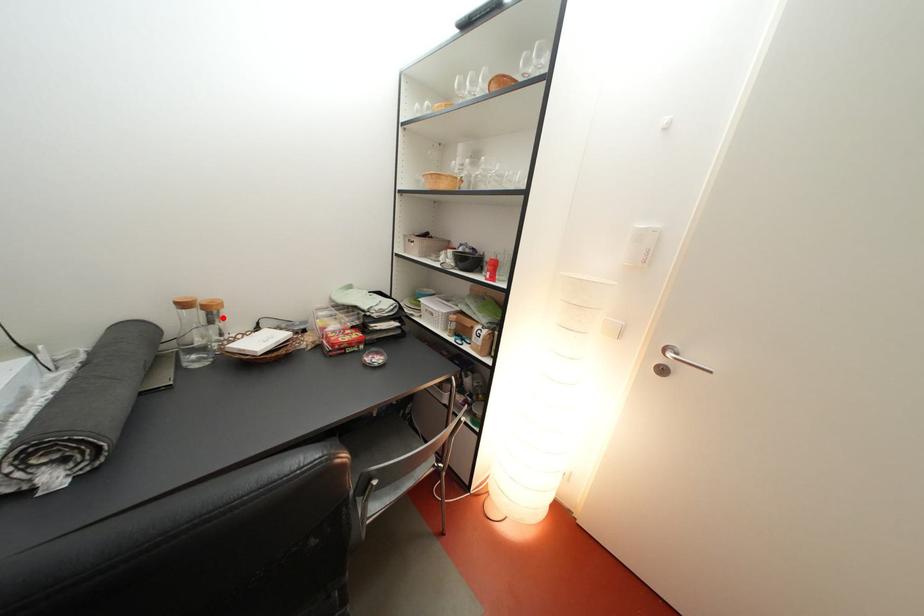
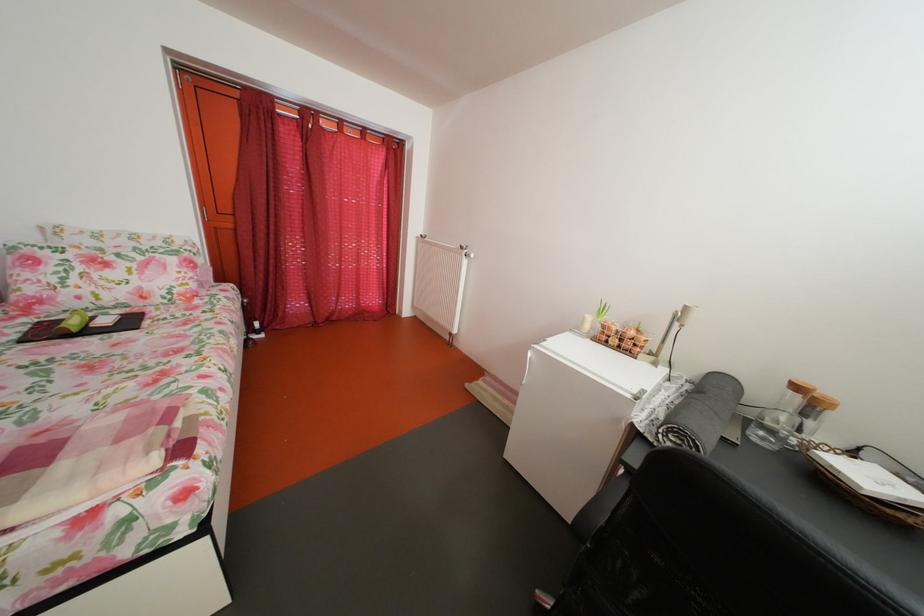
Locate, in the second image, the point that corresponds to the highlighted location in the first image.

(824, 411)